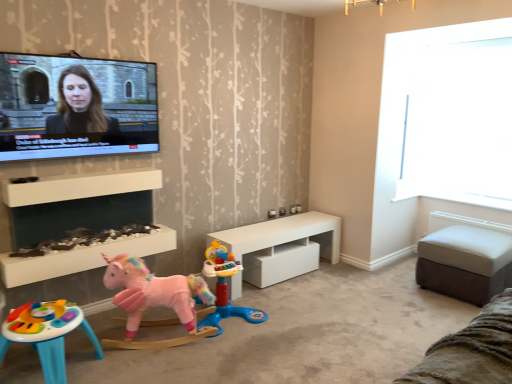
Question: Is white matte shelf at center, arranged as the 2th shelf when ordered from the bottom, next to white glossy table at center, the 2th table positioned from the right?

Choices:
 (A) no
 (B) yes

Answer: (A)

Question: Does white matte shelf at center, arranged as the 2th shelf when ordered from the bottom, lie in front of white glossy table at center, which is the 1th table from left to right?

Choices:
 (A) yes
 (B) no

Answer: (A)

Question: Is white matte shelf at center, arranged as the 2th shelf when ordered from the bottom, located outside white glossy table at center, which is the 1th table from left to right?

Choices:
 (A) yes
 (B) no

Answer: (A)

Question: Does white matte shelf at center, arranged as the 2th shelf when ordered from the bottom, come behind white glossy table at center, which is the 1th table from left to right?

Choices:
 (A) no
 (B) yes

Answer: (A)

Question: Does white matte shelf at center, arranged as the 2th shelf when ordered from the bottom, have a greater height compared to white glossy table at center, the 2th table positioned from the right?

Choices:
 (A) no
 (B) yes

Answer: (A)

Question: Relative to brown suede ottoman at lower right, is white glossy fireplace at lower left, which is counted as the 1th shelf, starting from the bottom, in front or behind?

Choices:
 (A) front
 (B) behind

Answer: (B)

Question: From the image's perspective, is white glossy fireplace at lower left, marked as the second shelf in a top-to-bottom arrangement, positioned above or below brown suede ottoman at lower right?

Choices:
 (A) below
 (B) above

Answer: (B)

Question: Considering the positions of white glossy fireplace at lower left, which is counted as the 1th shelf, starting from the bottom, and brown suede ottoman at lower right in the image, is white glossy fireplace at lower left, which is counted as the 1th shelf, starting from the bottom, taller or shorter than brown suede ottoman at lower right?

Choices:
 (A) tall
 (B) short

Answer: (B)

Question: Considering the positions of point (141, 177) and point (480, 360), is point (141, 177) closer or farther from the camera than point (480, 360)?

Choices:
 (A) farther
 (B) closer

Answer: (A)

Question: Considering their positions, is white glossy table at center, which is the 1th table from left to right, located in front of or behind white leather ottoman at right, which is the first table in right-to-left order?

Choices:
 (A) behind
 (B) front

Answer: (A)

Question: Looking at their shapes, would you say white glossy table at center, which is the 1th table from left to right, is wider or thinner than white leather ottoman at right, which is the first table in right-to-left order?

Choices:
 (A) thin
 (B) wide

Answer: (A)

Question: Is point (273, 251) closer or farther from the camera than point (456, 253)?

Choices:
 (A) farther
 (B) closer

Answer: (A)

Question: From the image's perspective, relative to white leather ottoman at right, which is the first table in right-to-left order, is white glossy table at center, the 2th table positioned from the right, above or below?

Choices:
 (A) below
 (B) above

Answer: (B)

Question: Based on their sizes in the image, would you say white glossy fireplace at lower left, marked as the second shelf in a top-to-bottom arrangement, is bigger or smaller than white glossy table at center, the 2th table positioned from the right?

Choices:
 (A) big
 (B) small

Answer: (B)

Question: Is point (46, 276) positioned closer to the camera than point (228, 283)?

Choices:
 (A) farther
 (B) closer

Answer: (B)